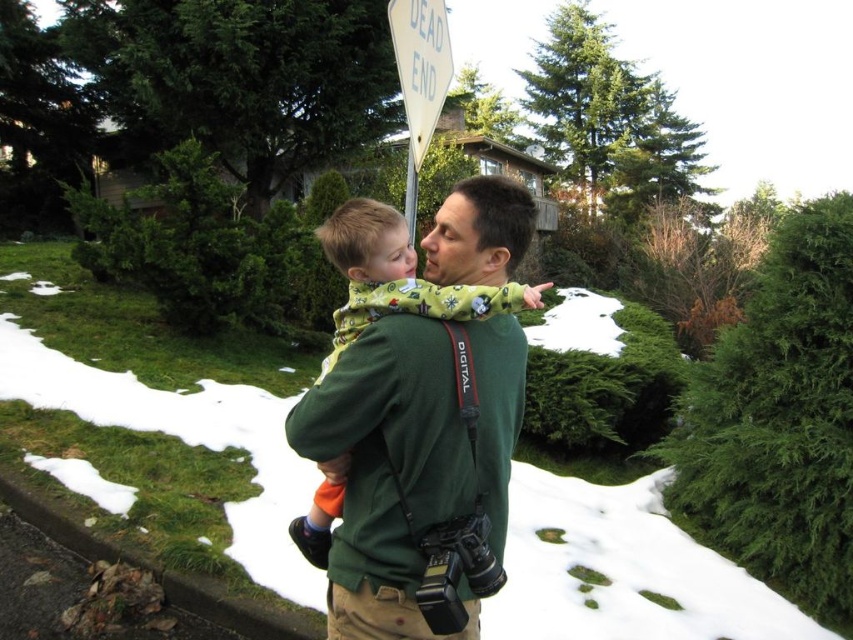
Question: Which of the following is the closest to the observer?

Choices:
 (A) (323, 250)
 (B) (416, 144)

Answer: (B)

Question: Which object is farther from the camera taking this photo?

Choices:
 (A) flannel pajamas at center
 (B) white paper street sign at upper center

Answer: (B)

Question: Is flannel pajamas at center positioned at the back of white paper street sign at upper center?

Choices:
 (A) yes
 (B) no

Answer: (B)

Question: Which of the following is the farthest from the observer?

Choices:
 (A) (473, 305)
 (B) (416, 12)

Answer: (B)

Question: In this image, where is flannel pajamas at center located relative to white paper street sign at upper center?

Choices:
 (A) below
 (B) above

Answer: (A)

Question: Where is flannel pajamas at center located in relation to white paper street sign at upper center in the image?

Choices:
 (A) below
 (B) above

Answer: (A)